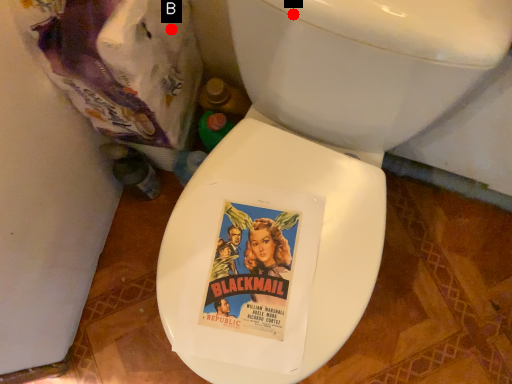
Question: Two points are circled on the image, labeled by A and B beside each circle. Which point is farther to the camera?

Choices:
 (A) A is further
 (B) B is further

Answer: (B)